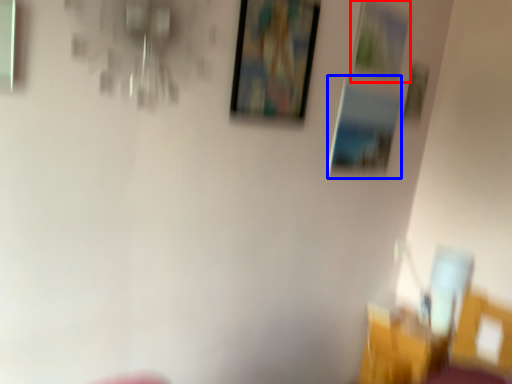
Question: Which of the following is the farthest to the observer, picture frame (highlighted by a red box) or picture frame (highlighted by a blue box)?

Choices:
 (A) picture frame
 (B) picture frame

Answer: (B)